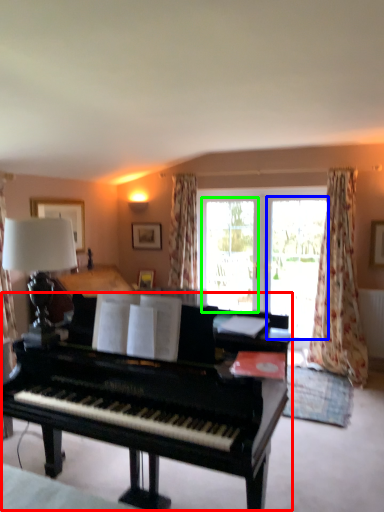
Question: Considering the real-world distances, which object is closest to piano (highlighted by a red box)? screen door (highlighted by a blue box) or screen door (highlighted by a green box).

Choices:
 (A) screen door
 (B) screen door

Answer: (A)